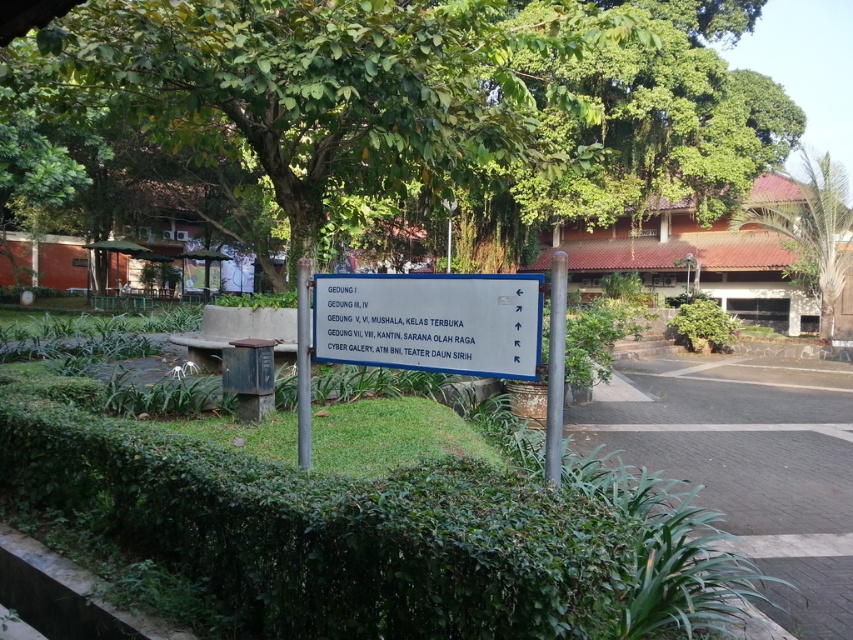
Between point (397, 93) and point (816, 236), which one is positioned in front?

Point (397, 93) is in front.

Identify the location of green leafy tree at upper center. The height and width of the screenshot is (640, 853). pyautogui.click(x=323, y=84).

Can you confirm if white plastic sign at center is positioned to the right of green leafy palm tree at upper right?

In fact, white plastic sign at center is to the left of green leafy palm tree at upper right.

Who is lower down, white plastic sign at center or green leafy palm tree at upper right?

white plastic sign at center is lower down.

Is point (503, 324) more distant than point (822, 289)?

No, it is in front of (822, 289).

Identify the location of white plastic sign at center. (430, 321).

Measure the distance from dark gray asphalt at lower right to green leafy palm tree at upper right.

A distance of 14.74 meters exists between dark gray asphalt at lower right and green leafy palm tree at upper right.

Describe the element at coordinates (749, 464) in the screenshot. I see `dark gray asphalt at lower right` at that location.

The width and height of the screenshot is (853, 640). Describe the element at coordinates (749, 464) in the screenshot. I see `dark gray asphalt at lower right` at that location.

I want to click on dark gray asphalt at lower right, so click(x=749, y=464).